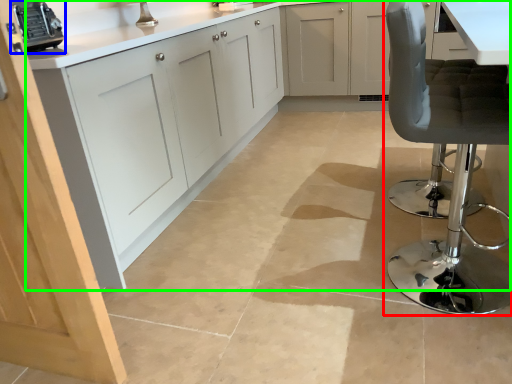
Question: Which object is the farthest from chair (highlighted by a red box)? Choose among these: appliance (highlighted by a blue box) or cabinetry (highlighted by a green box).

Choices:
 (A) appliance
 (B) cabinetry

Answer: (A)